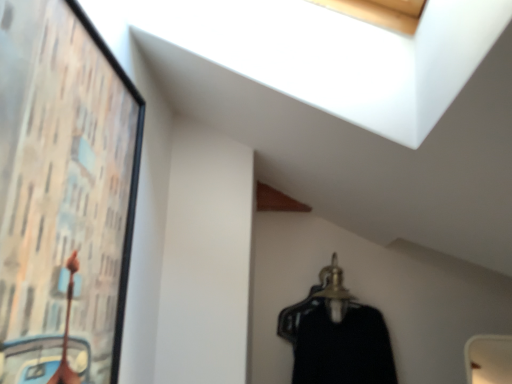
Question: In terms of width, does black matte dress at center look wider or thinner when compared to gold metallic hanger at lower center?

Choices:
 (A) thin
 (B) wide

Answer: (A)

Question: Do you think black matte dress at center is within gold metallic hanger at lower center, or outside of it?

Choices:
 (A) inside
 (B) outside

Answer: (B)

Question: Considering the real-world distances, which object is closest to the black matte dress at center?

Choices:
 (A) wooden framed artwork at left
 (B) gold metallic hanger at lower center

Answer: (B)

Question: Estimate the real-world distances between objects in this image. Which object is closer to the black matte dress at center?

Choices:
 (A) wooden framed artwork at left
 (B) gold metallic hanger at lower center

Answer: (B)